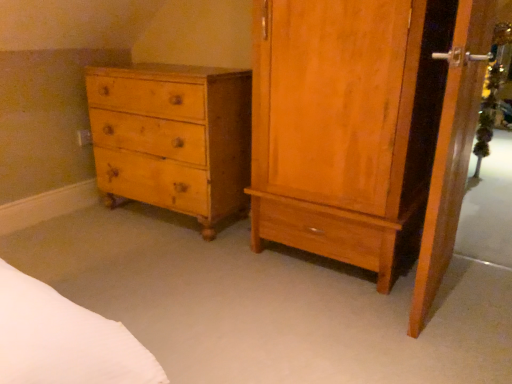
Locate an element on the screen. This screenshot has height=384, width=512. free point below wooden screen door at right (from a real-world perspective) is located at coordinates (440, 296).